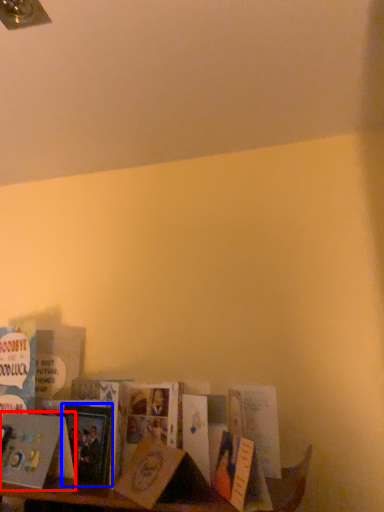
Question: Which of the following is the farthest to the observer, book (highlighted by a red box) or paperback book (highlighted by a blue box)?

Choices:
 (A) book
 (B) paperback book

Answer: (B)